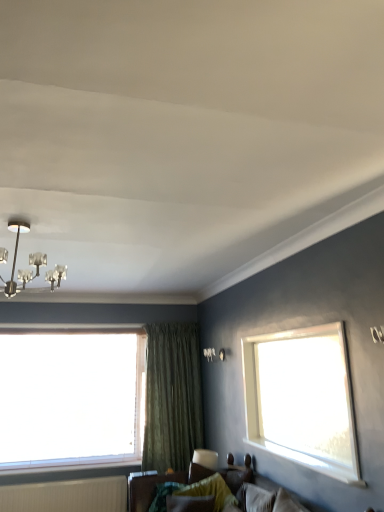
The image size is (384, 512). What do you see at coordinates (71, 399) in the screenshot? I see `transparent glass window at left` at bounding box center [71, 399].

Image resolution: width=384 pixels, height=512 pixels. Find the location of `white ribbed radiator at lower left`. white ribbed radiator at lower left is located at coordinates (67, 496).

Identify the location of metallic chandelier at upper left. (16, 259).

From a real-world perspective, who is located higher, velvet green pillow at lower center or green textured curtain at center?

green textured curtain at center, from a real-world perspective.

Is velvet green pillow at lower center facing towards green textured curtain at center?

No, velvet green pillow at lower center is not oriented towards green textured curtain at center.

Based on their positions, is velvet green pillow at lower center located to the left or right of green textured curtain at center?

Based on their positions, velvet green pillow at lower center is located to the right of green textured curtain at center.

How different are the orientations of velvet green pillow at lower center and green textured curtain at center in degrees?

They differ by 84 degrees in their facing directions.

From a real-world perspective, who is located higher, textured fabric couch at lower center or green textured curtain at center?

In real-world perspective, green textured curtain at center is above.

How different are the orientations of textured fabric couch at lower center and green textured curtain at center in degrees?

They differ by 90 degrees in their facing directions.

Is textured fabric couch at lower center looking in the opposite direction of green textured curtain at center?

No, green textured curtain at center is not at the back of textured fabric couch at lower center.

Which object is further away from the camera taking this photo, textured fabric couch at lower center or green textured curtain at center?

green textured curtain at center is more distant.

From a real-world perspective, who is located higher, textured fabric couch at lower center or white ribbed radiator at lower left?

In real-world perspective, textured fabric couch at lower center is above.

Who is more distant, textured fabric couch at lower center or white ribbed radiator at lower left?

white ribbed radiator at lower left is more distant.

From their relative heights in the image, would you say textured fabric couch at lower center is taller or shorter than white ribbed radiator at lower left?

Considering their sizes, textured fabric couch at lower center has more height than white ribbed radiator at lower left.

Is textured fabric couch at lower center smaller than white ribbed radiator at lower left?

Actually, textured fabric couch at lower center might be larger than white ribbed radiator at lower left.

Where is `studio couch located in front of the green textured curtain at center`? studio couch located in front of the green textured curtain at center is located at coordinates (159, 483).

Is green textured curtain at center aimed at textured fabric couch at lower center?

Yes, green textured curtain at center is oriented towards textured fabric couch at lower center.

Would you consider green textured curtain at center to be distant from textured fabric couch at lower center?

Indeed, green textured curtain at center is not near textured fabric couch at lower center.

From the image's perspective, does green textured curtain at center appear lower than textured fabric couch at lower center?

No, from the image's perspective, green textured curtain at center is not beneath textured fabric couch at lower center.

Can you tell me how much transparent glass window at left and textured fabric couch at lower center differ in facing direction?

90.3 degrees.

From the image's perspective, between transparent glass window at left and textured fabric couch at lower center, which one is located above?

transparent glass window at left is shown above in the image.

Identify the location of studio couch that appears below the transparent glass window at left (from a real-world perspective). This screenshot has height=512, width=384. (159, 483).

Does transparent glass window at left have a larger size compared to textured fabric couch at lower center?

No.

Is metallic chandelier at upper left located outside velvet green pillow at lower center?

Yes, metallic chandelier at upper left is located beyond the bounds of velvet green pillow at lower center.

Considering the sizes of objects metallic chandelier at upper left and velvet green pillow at lower center in the image provided, who is taller, metallic chandelier at upper left or velvet green pillow at lower center?

metallic chandelier at upper left.

From the image's perspective, which is above, metallic chandelier at upper left or velvet green pillow at lower center?

metallic chandelier at upper left appears higher in the image.

Based on their sizes in the image, would you say metallic chandelier at upper left is bigger or smaller than green textured curtain at center?

In the image, metallic chandelier at upper left appears to be smaller than green textured curtain at center.

Considering the relative sizes of metallic chandelier at upper left and green textured curtain at center in the image provided, is metallic chandelier at upper left thinner than green textured curtain at center?

No.

Considering the sizes of objects metallic chandelier at upper left and green textured curtain at center in the image provided, who is shorter, metallic chandelier at upper left or green textured curtain at center?

metallic chandelier at upper left.

Could you tell me if metallic chandelier at upper left is turned towards green textured curtain at center?

No.

Locate an element on the screen. This screenshot has height=512, width=384. curtain behind the velvet green pillow at lower center is located at coordinates (172, 397).

In order to click on studio couch below the green textured curtain at center (from the image's perspective) in this screenshot , I will do `click(159, 483)`.

From the image, which object appears to be farther from green textured curtain at center, textured fabric couch at lower center or white ribbed radiator at lower left?

textured fabric couch at lower center is positioned further to the anchor green textured curtain at center.

Looking at the image, which one is located closer to white ribbed radiator at lower left, transparent glass window at left or velvet green pillow at lower center?

transparent glass window at left.

Considering their positions, is green textured curtain at center positioned further to white ribbed radiator at lower left than transparent glass window at left?

The object further to white ribbed radiator at lower left is green textured curtain at center.

Estimate the real-world distances between objects in this image. Which object is further from velvet green pillow at lower center, metallic chandelier at upper left or white ribbed radiator at lower left?

white ribbed radiator at lower left lies further to velvet green pillow at lower center than the other object.

Estimate the real-world distances between objects in this image. Which object is closer to green textured curtain at center, metallic chandelier at upper left or textured fabric couch at lower center?

textured fabric couch at lower center lies closer to green textured curtain at center than the other object.

From the picture: Considering their positions, is green textured curtain at center positioned further to transparent glass window at left than velvet green pillow at lower center?

velvet green pillow at lower center.

Estimate the real-world distances between objects in this image. Which object is further from metallic chandelier at upper left, white ribbed radiator at lower left or textured fabric couch at lower center?

Among the two, white ribbed radiator at lower left is located further to metallic chandelier at upper left.

When comparing their distances from metallic chandelier at upper left, does white ribbed radiator at lower left or transparent glass window at left seem further?

The object further to metallic chandelier at upper left is white ribbed radiator at lower left.

Find the location of a particular element. This screenshot has height=512, width=384. window between textured fabric couch at lower center and green textured curtain at center in the front-back direction is located at coordinates (71, 399).

Locate an element on the screen. Image resolution: width=384 pixels, height=512 pixels. studio couch between metallic chandelier at upper left and velvet green pillow at lower center vertically is located at coordinates (159, 483).

I want to click on pillow between metallic chandelier at upper left and white ribbed radiator at lower left in the up-down direction, so click(210, 490).

The image size is (384, 512). What are the coordinates of `radiator between metallic chandelier at upper left and transparent glass window at left in the front-back direction` in the screenshot? It's located at (67, 496).